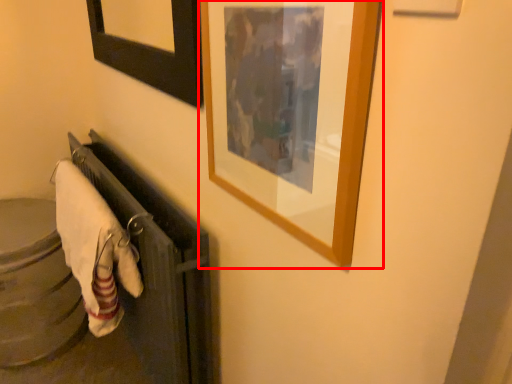
Question: Considering the relative positions of picture frame (annotated by the red box) and bath towel in the image provided, where is picture frame (annotated by the red box) located with respect to the staircase?

Choices:
 (A) left
 (B) right

Answer: (B)